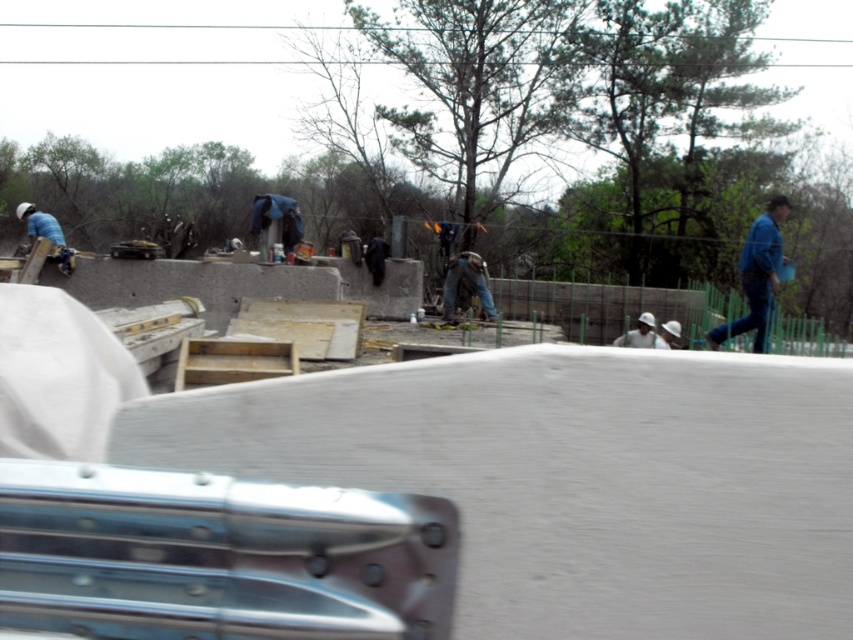
Question: Is smooth concrete at center in front of blue denim jeans at right?

Choices:
 (A) no
 (B) yes

Answer: (B)

Question: Is smooth concrete at center to the right of blue denim jeans at right from the viewer's perspective?

Choices:
 (A) no
 (B) yes

Answer: (A)

Question: Which point appears closest to the camera in this image?

Choices:
 (A) (456, 376)
 (B) (763, 307)

Answer: (A)

Question: Can you confirm if smooth concrete at center is thinner than blue denim jeans at right?

Choices:
 (A) yes
 (B) no

Answer: (B)

Question: Among these objects, which one is nearest to the camera?

Choices:
 (A) smooth concrete at center
 (B) blue denim jeans at right

Answer: (A)